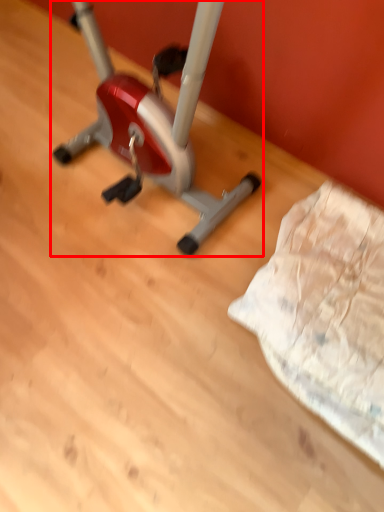
Question: From the image's perspective, what is the correct spatial relationship of stationary bicycle (annotated by the red box) in relation to sheet?

Choices:
 (A) below
 (B) above

Answer: (B)